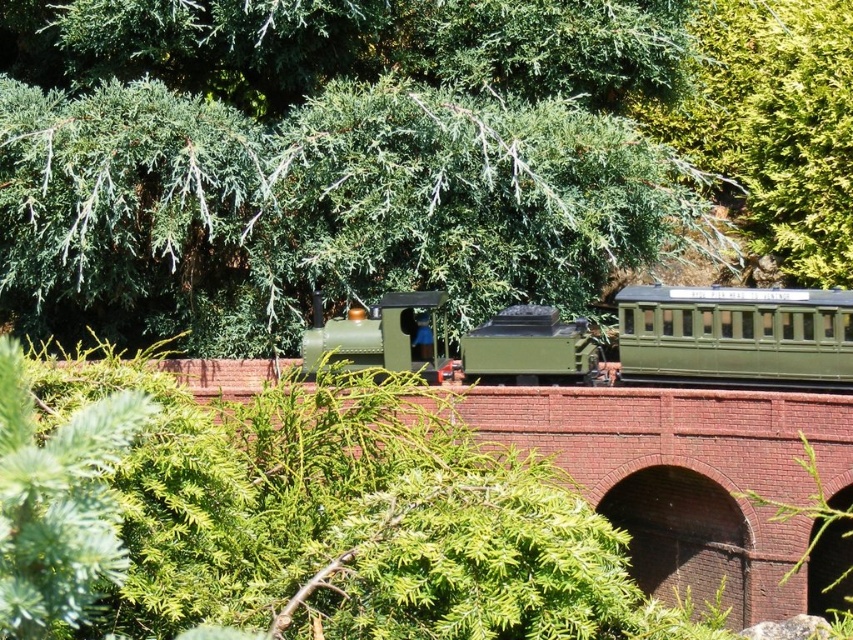
You are a bird flying over the miniature model train set. You want to land on the closest object between the green leafy tree at upper center and the green matte steam train at center. Which object should you choose?

The green leafy tree at upper center and green matte steam train at center are 17.08 feet apart from each other. Since you want to land on the closest object, you need to choose the one that is nearer to your current position. However, without knowing your exact location, it is impossible to determine which object is closer. Please provide your current position relative to both objects.

You are a passenger on the green matte steam train at center and want to look out the window to see the green leafy tree at upper center. Is the tree above or below the train?

The green leafy tree at upper center is positioned over the green matte steam train at center, so the tree is above the train.